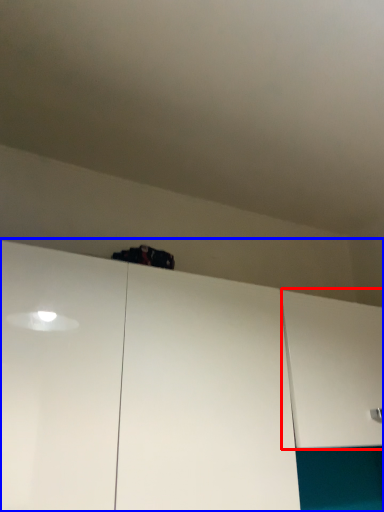
Question: Which point is further to the camera, cabinetry (highlighted by a red box) or cabinetry (highlighted by a blue box)?

Choices:
 (A) cabinetry
 (B) cabinetry

Answer: (A)